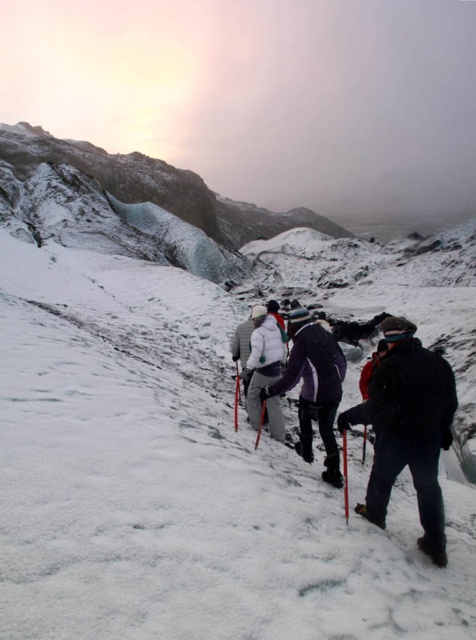
You are a hiker planning to take a photo of the dark blue jacket at lower right. What are the coordinates where you should aim your camera?

The dark blue jacket at lower right is located at coordinates (407, 429).